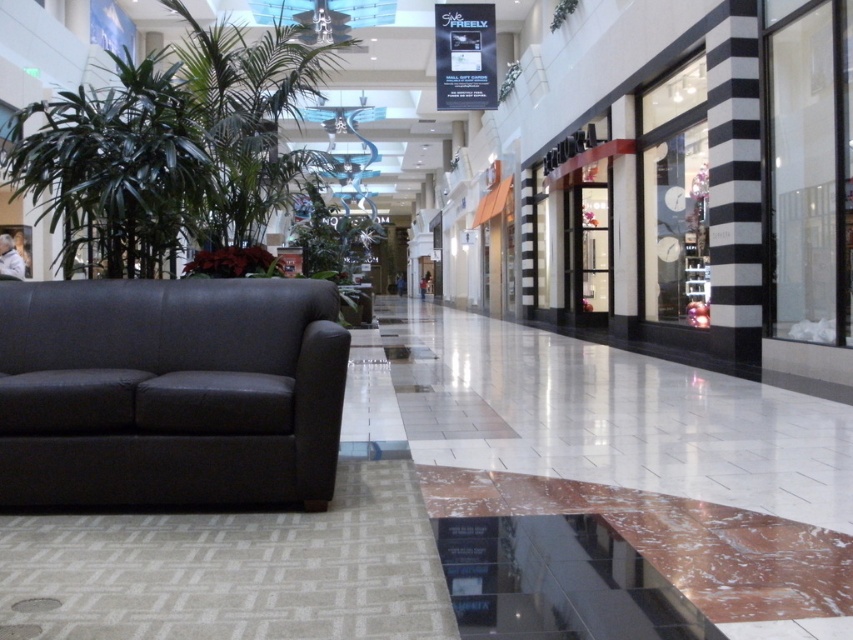
You are standing in the shopping mall and want to sit on the matte black couch at left. Based on the coordinates provided, can you determine if the couch is positioned closer to the entrance or the exit of the mall?

The coordinates of the matte black couch at left are at point [169,392], but without knowing the coordinate system orientation or the entrance and exit positions, it is impossible to determine its proximity to either.

You are a delivery person carrying a package that requires a clear path of at least 2 meters between the matte black couch at left and the green leafy plant at left. Can you safely navigate through this area?

→ The distance between the matte black couch at left and the green leafy plant at left is 2.43 meters, which is more than the required 2 meters. Therefore, you can safely navigate through this area with the package.